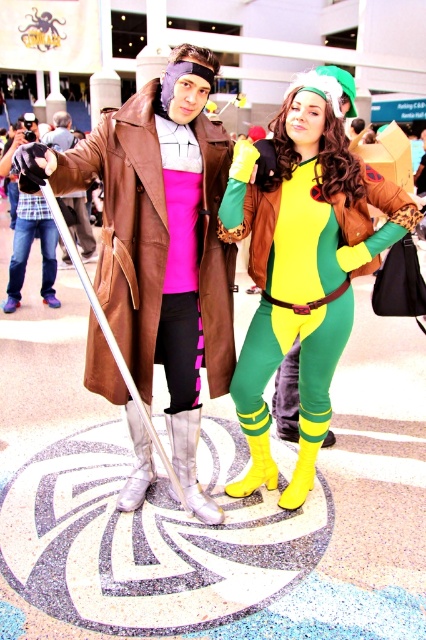
From the picture: You are a photographer at a cosplay event. You want to take a photo of the green spandex suit at center and the matte brown coat at center. Can you fit both subjects in the frame if your camera has a minimum distance requirement of 15 inches between the closest subjects?

The green spandex suit at center and matte brown coat at center are 14.49 inches apart, which is less than the 15 inches required by the camera. Therefore, you cannot fit both subjects in the frame.

You are a photographer at a cosplay event and need to frame both the green spandex suit at center and the matte brown coat at center in a single shot. Which costume should you focus on first to ensure both are visible in the frame?

The green spandex suit at center is larger in size than the matte brown coat at center, so you should focus on the green spandex suit at center first to ensure both are visible in the frame.